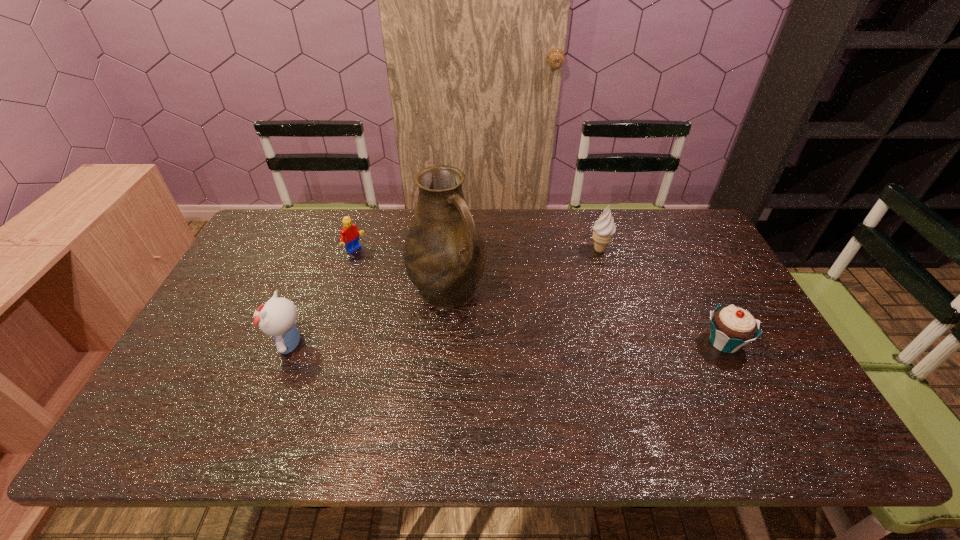
What are the coordinates of `free spot that satisfies the following two spatial constraints: 1. on the front side of the rightmost object; 2. on the right side of the third farthest object` in the screenshot? It's located at (444, 343).

Find the location of a particular element. The width and height of the screenshot is (960, 540). vacant space that satisfies the following two spatial constraints: 1. on the front side of the second object from right to left; 2. on the right side of the cupcake is located at coordinates (628, 343).